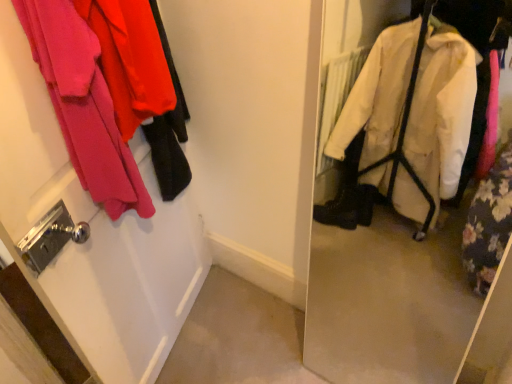
I want to click on white matte door at left, so pos(96,232).

What do you see at coordinates (96, 232) in the screenshot? This screenshot has height=384, width=512. I see `white matte door at left` at bounding box center [96, 232].

Measure the distance between point (160, 199) and camera.

Point (160, 199) is 1.47 meters from camera.

Describe the element at coordinates (83, 105) in the screenshot. The image size is (512, 384). I see `matte pink fabric at upper left` at that location.

Identify the location of matte pink fabric at upper left. (83, 105).

Locate an element on the screen. Image resolution: width=512 pixels, height=384 pixels. white matte door at left is located at coordinates (96, 232).

Is matte pink fabric at upper left at the right side of white matte door at left?

Correct, you'll find matte pink fabric at upper left to the right of white matte door at left.

Considering the positions of objects matte pink fabric at upper left and white matte door at left in the image provided, who is behind, matte pink fabric at upper left or white matte door at left?

matte pink fabric at upper left is further away from the camera.

Is point (35, 56) positioned in front of point (127, 375)?

Yes.

From the image's perspective, is matte pink fabric at upper left located beneath white matte door at left?

Actually, matte pink fabric at upper left appears above white matte door at left in the image.

From a real-world perspective, relative to white matte door at left, is matte pink fabric at upper left vertically above or below?

matte pink fabric at upper left is situated higher than white matte door at left in the real world.

Based on the photo, does matte pink fabric at upper left have a greater width compared to white matte door at left?

Yes.

Considering the sizes of objects matte pink fabric at upper left and white matte door at left in the image provided, who is shorter, matte pink fabric at upper left or white matte door at left?

matte pink fabric at upper left.

Based on their sizes in the image, would you say matte pink fabric at upper left is bigger or smaller than white matte door at left?

Considering their sizes, matte pink fabric at upper left takes up less space than white matte door at left.

Is matte pink fabric at upper left situated inside white matte door at left or outside?

matte pink fabric at upper left can be found inside white matte door at left.

Is matte pink fabric at upper left far from white matte door at left?

No, matte pink fabric at upper left is not far away from white matte door at left.

From the picture: Is matte pink fabric at upper left oriented away from white matte door at left?

That's not correct — matte pink fabric at upper left is not looking away from white matte door at left.

The width and height of the screenshot is (512, 384). Find the location of `door in front of the matte pink fabric at upper left`. door in front of the matte pink fabric at upper left is located at coordinates (96, 232).

Between white matte door at left and matte pink fabric at upper left, which one appears on the right side from the viewer's perspective?

From the viewer's perspective, matte pink fabric at upper left appears more on the right side.

Does white matte door at left lie in front of matte pink fabric at upper left?

Yes, the depth of white matte door at left is less than that of matte pink fabric at upper left.

Considering the positions of points (15, 94) and (53, 10), is point (15, 94) closer to camera compared to point (53, 10)?

No.

From the image's perspective, which is above, white matte door at left or matte pink fabric at upper left?

matte pink fabric at upper left.

From a real-world perspective, between white matte door at left and matte pink fabric at upper left, who is vertically higher?

From a 3D spatial view, matte pink fabric at upper left is above.

Looking at their sizes, would you say white matte door at left is wider or thinner than matte pink fabric at upper left?

In the image, white matte door at left appears to be more narrow than matte pink fabric at upper left.

Which of these two, white matte door at left or matte pink fabric at upper left, stands shorter?

With less height is matte pink fabric at upper left.

Between white matte door at left and matte pink fabric at upper left, which one has larger size?

white matte door at left.

Would you say white matte door at left is outside matte pink fabric at upper left?

Indeed, white matte door at left is completely outside matte pink fabric at upper left.

Is white matte door at left next to matte pink fabric at upper left and touching it?

They are not placed beside each other.

Is white matte door at left facing away from matte pink fabric at upper left?

Yes.

How far apart are white matte door at left and matte pink fabric at upper left?

white matte door at left is 7.29 inches from matte pink fabric at upper left.

You are a GUI agent. You are given a task and a screenshot of the screen. Output one action in this format:
    pyautogui.click(x=<x>, y=<y>)
    Task: Click on the door below the matte pink fabric at upper left (from the image's perspective)
    
    Given the screenshot: What is the action you would take?
    pyautogui.click(x=96, y=232)

Locate an element on the screen. The image size is (512, 384). door that appears below the matte pink fabric at upper left (from a real-world perspective) is located at coordinates (96, 232).

The height and width of the screenshot is (384, 512). Find the location of `closet lying on the right of white matte door at left`. closet lying on the right of white matte door at left is located at coordinates (83, 105).